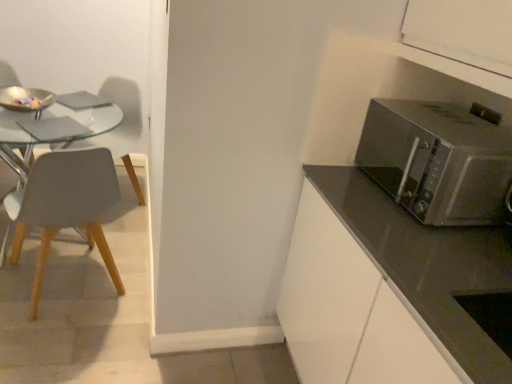
This screenshot has width=512, height=384. In order to click on satin silver microwave at right in this screenshot , I will do `click(438, 160)`.

What is the approximate width of matte gray chair at left, the 2th chair viewed from the back?

matte gray chair at left, the 2th chair viewed from the back, is 21.31 inches in width.

Locate an element on the screen. matte gray chair at left, the 2th chair viewed from the back is located at coordinates (65, 206).

Describe the element at coordinates (122, 126) in the screenshot. I see `matte gray chair at left, which is counted as the 2th chair, starting from the front` at that location.

This screenshot has width=512, height=384. What are the coordinates of `satin silver microwave at right` in the screenshot? It's located at (438, 160).

Would you say satin silver microwave at right is a long distance from matte gray chair at left, which appears as the 1th chair when viewed from the front?

Yes, satin silver microwave at right and matte gray chair at left, which appears as the 1th chair when viewed from the front, are located far from each other.

Is satin silver microwave at right looking in the opposite direction of matte gray chair at left, the 2th chair viewed from the back?

No, satin silver microwave at right's orientation is not away from matte gray chair at left, the 2th chair viewed from the back.

Is point (451, 180) in front of point (55, 223)?

Yes.

At what (x,y) coordinates should I click in order to perform the action: click on microwave oven above the matte gray chair at left, which appears as the 1th chair when viewed from the front (from the image's perspective). Please return your answer as a coordinate pair (x, y). Looking at the image, I should click on coord(438,160).

Considering the positions of point (35, 200) and point (125, 99), is point (35, 200) closer or farther from the camera than point (125, 99)?

Point (35, 200) appears to be closer to the viewer than point (125, 99).

Between matte gray chair at left, which appears as the 1th chair when viewed from the front, and matte gray chair at left, placed as the 1th chair when sorted from back to front, which one has less height?

With less height is matte gray chair at left, which appears as the 1th chair when viewed from the front.

How different are the orientations of matte gray chair at left, the 2th chair viewed from the back, and matte gray chair at left, which is counted as the 2th chair, starting from the front, in degrees?

The angular difference between matte gray chair at left, the 2th chair viewed from the back, and matte gray chair at left, which is counted as the 2th chair, starting from the front, is 120 degrees.

Is there a large distance between matte gray chair at left, the 2th chair viewed from the back, and matte gray chair at left, placed as the 1th chair when sorted from back to front?

They are positioned close to each other.

From a real-world perspective, does matte gray chair at left, which is counted as the 2th chair, starting from the front, sit lower than satin silver microwave at right?

Yes.

Can you tell me how much matte gray chair at left, placed as the 1th chair when sorted from back to front, and satin silver microwave at right differ in facing direction?

46.5 degrees.

Is matte gray chair at left, placed as the 1th chair when sorted from back to front, located outside satin silver microwave at right?

Yes, matte gray chair at left, placed as the 1th chair when sorted from back to front, is outside of satin silver microwave at right.

Does matte gray chair at left, placed as the 1th chair when sorted from back to front, have a greater width compared to satin silver microwave at right?

Correct, the width of matte gray chair at left, placed as the 1th chair when sorted from back to front, exceeds that of satin silver microwave at right.

From a real-world perspective, between matte gray chair at left, placed as the 1th chair when sorted from back to front, and matte gray chair at left, which appears as the 1th chair when viewed from the front, who is vertically higher?

From a 3D spatial view, matte gray chair at left, placed as the 1th chair when sorted from back to front, is above.

Is matte gray chair at left, placed as the 1th chair when sorted from back to front, taller or shorter than matte gray chair at left, the 2th chair viewed from the back?

matte gray chair at left, placed as the 1th chair when sorted from back to front, is taller than matte gray chair at left, the 2th chair viewed from the back.

Could you tell me if matte gray chair at left, which is counted as the 2th chair, starting from the front, is turned towards matte gray chair at left, the 2th chair viewed from the back?

No, matte gray chair at left, which is counted as the 2th chair, starting from the front, is not turned towards matte gray chair at left, the 2th chair viewed from the back.

From the image's perspective, which one is positioned higher, matte gray chair at left, which is counted as the 2th chair, starting from the front, or matte gray chair at left, which appears as the 1th chair when viewed from the front?

matte gray chair at left, which is counted as the 2th chair, starting from the front.

In the scene shown: Can you confirm if satin silver microwave at right is bigger than matte gray chair at left, which is counted as the 2th chair, starting from the front?

No.

Is satin silver microwave at right with matte gray chair at left, which is counted as the 2th chair, starting from the front?

No, satin silver microwave at right is not with matte gray chair at left, which is counted as the 2th chair, starting from the front.

From the image's perspective, is satin silver microwave at right positioned above or below matte gray chair at left, placed as the 1th chair when sorted from back to front?

Clearly, from the image's perspective, satin silver microwave at right is below matte gray chair at left, placed as the 1th chair when sorted from back to front.

Which chair is the 2nd one when counting from the left side of the satin silver microwave at right? Please provide its 2D coordinates.

[(122, 126)]

Looking at this image, is the surface of matte gray chair at left, the 2th chair viewed from the back, in direct contact with satin silver microwave at right?

No, matte gray chair at left, the 2th chair viewed from the back, is not in contact with satin silver microwave at right.

Is matte gray chair at left, which appears as the 1th chair when viewed from the front, wider than satin silver microwave at right?

Yes.

Which of these two, matte gray chair at left, the 2th chair viewed from the back, or satin silver microwave at right, is smaller?

satin silver microwave at right is smaller.

Locate an element on the screen. The image size is (512, 384). microwave oven on the right of matte gray chair at left, which appears as the 1th chair when viewed from the front is located at coordinates (438, 160).

Find the location of a particular element. This screenshot has height=384, width=512. chair below the matte gray chair at left, which is counted as the 2th chair, starting from the front (from a real-world perspective) is located at coordinates (65, 206).

Looking at the image, which one is located closer to matte gray chair at left, the 2th chair viewed from the back, matte gray chair at left, placed as the 1th chair when sorted from back to front, or satin silver microwave at right?

Based on the image, matte gray chair at left, placed as the 1th chair when sorted from back to front, appears to be nearer to matte gray chair at left, the 2th chair viewed from the back.

From the image, which object appears to be nearer to matte gray chair at left, placed as the 1th chair when sorted from back to front, matte gray chair at left, the 2th chair viewed from the back, or satin silver microwave at right?

The object closer to matte gray chair at left, placed as the 1th chair when sorted from back to front, is matte gray chair at left, the 2th chair viewed from the back.

From the picture: Considering their positions, is satin silver microwave at right positioned closer to matte gray chair at left, the 2th chair viewed from the back, than matte gray chair at left, which is counted as the 2th chair, starting from the front?

Among the two, matte gray chair at left, which is counted as the 2th chair, starting from the front, is located nearer to matte gray chair at left, the 2th chair viewed from the back.

Which object lies nearer to the anchor point matte gray chair at left, placed as the 1th chair when sorted from back to front, satin silver microwave at right or matte gray chair at left, the 2th chair viewed from the back?

matte gray chair at left, the 2th chair viewed from the back.

Based on their spatial positions, is matte gray chair at left, placed as the 1th chair when sorted from back to front, or matte gray chair at left, the 2th chair viewed from the back, closer to satin silver microwave at right?

Based on the image, matte gray chair at left, the 2th chair viewed from the back, appears to be nearer to satin silver microwave at right.

From the image, which object appears to be farther from satin silver microwave at right, matte gray chair at left, which appears as the 1th chair when viewed from the front, or matte gray chair at left, placed as the 1th chair when sorted from back to front?

matte gray chair at left, placed as the 1th chair when sorted from back to front, is further to satin silver microwave at right.

Where is `chair between matte gray chair at left, placed as the 1th chair when sorted from back to front, and satin silver microwave at right`? This screenshot has width=512, height=384. chair between matte gray chair at left, placed as the 1th chair when sorted from back to front, and satin silver microwave at right is located at coordinates (65, 206).